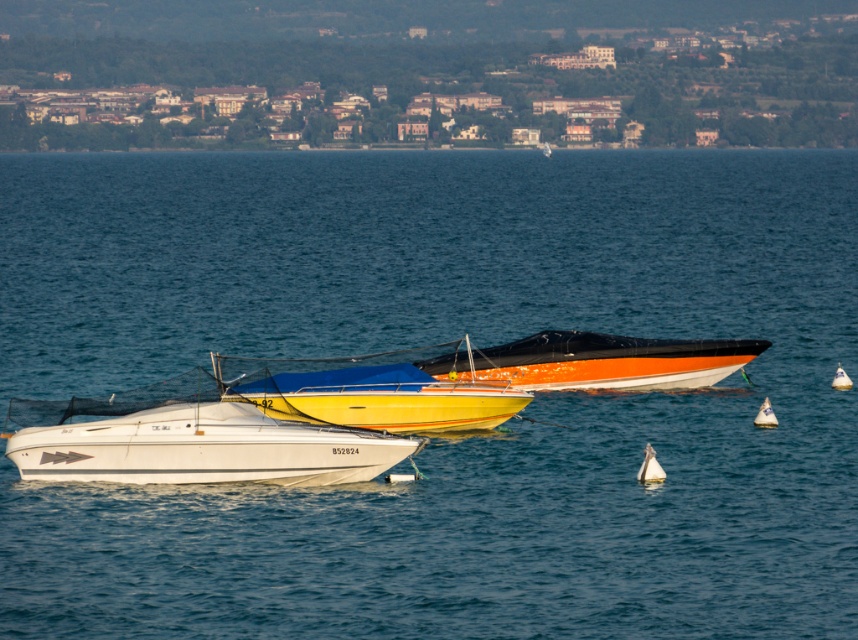
You are planning to board a boat and need to choose between the yellow matte boat at center and the orange glossy boat at center. If you prefer a wider boat for more space, which one should you choose?

The orange glossy boat at center is wider than the yellow matte boat at center, so you should choose the orange glossy boat at center for more space.

You are standing on the dock and see the yellow matte boat at center and the orange glossy boat at center. Which boat is closer to you?

The yellow matte boat at center is closer to the viewer than the orange glossy boat at center.